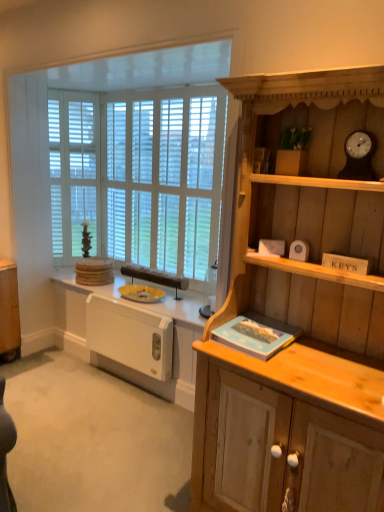
Question: Is white matte radiator at lower left aimed at wooden clock at upper right?

Choices:
 (A) yes
 (B) no

Answer: (B)

Question: Is white matte radiator at lower left wider than wooden clock at upper right?

Choices:
 (A) no
 (B) yes

Answer: (A)

Question: From the image's perspective, would you say white matte radiator at lower left is shown under wooden clock at upper right?

Choices:
 (A) yes
 (B) no

Answer: (A)

Question: Would you consider white matte radiator at lower left to be distant from wooden clock at upper right?

Choices:
 (A) yes
 (B) no

Answer: (A)

Question: Does white matte radiator at lower left have a greater height compared to wooden clock at upper right?

Choices:
 (A) yes
 (B) no

Answer: (A)

Question: From a real-world perspective, relative to white wooden window at upper left, is white wooden blinds at center vertically above or below?

Choices:
 (A) above
 (B) below

Answer: (A)

Question: Considering the relative positions of white wooden blinds at center and white wooden window at upper left in the image provided, is white wooden blinds at center to the left or to the right of white wooden window at upper left?

Choices:
 (A) left
 (B) right

Answer: (B)

Question: Choose the correct answer: Is white wooden blinds at center inside white wooden window at upper left or outside it?

Choices:
 (A) inside
 (B) outside

Answer: (B)

Question: Considering their positions, is white wooden blinds at center located in front of or behind white wooden window at upper left?

Choices:
 (A) behind
 (B) front

Answer: (A)

Question: Considering the positions of white matte radiator at lower left and white wood blinds at left in the image, is white matte radiator at lower left wider or thinner than white wood blinds at left?

Choices:
 (A) wide
 (B) thin

Answer: (B)

Question: From a real-world perspective, is white matte radiator at lower left physically located above or below white wood blinds at left?

Choices:
 (A) below
 (B) above

Answer: (A)

Question: Considering the positions of point (165, 392) and point (51, 245), is point (165, 392) closer or farther from the camera than point (51, 245)?

Choices:
 (A) farther
 (B) closer

Answer: (B)

Question: Relative to white wood blinds at left, is white matte radiator at lower left in front or behind?

Choices:
 (A) front
 (B) behind

Answer: (A)

Question: Is point (96, 300) closer or farther from the camera than point (362, 138)?

Choices:
 (A) farther
 (B) closer

Answer: (A)

Question: From the image's perspective, is white plastic radiator at lower left positioned above or below wooden clock at upper right?

Choices:
 (A) above
 (B) below

Answer: (B)